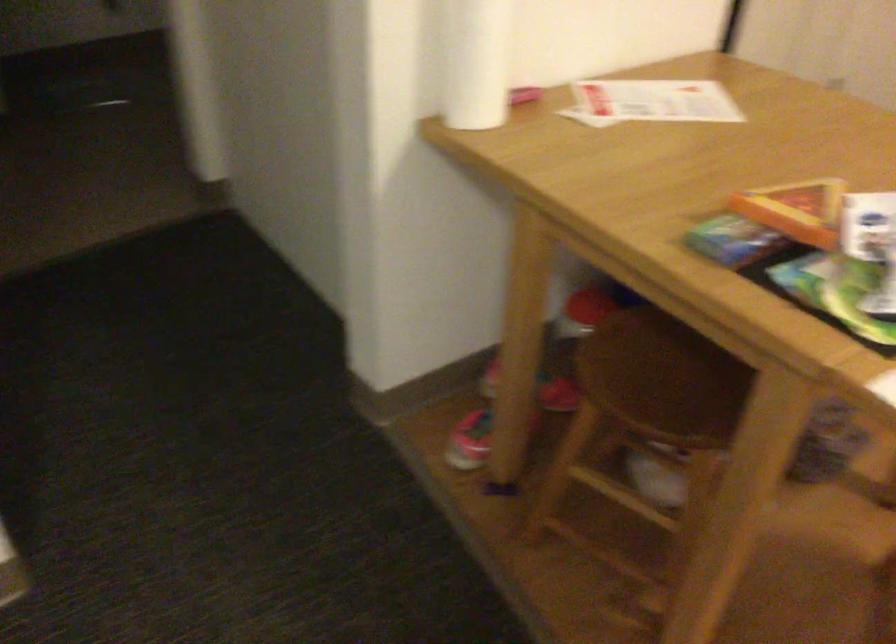
The height and width of the screenshot is (644, 896). Find the location of `chair sitting surface`. chair sitting surface is located at coordinates (627, 549).